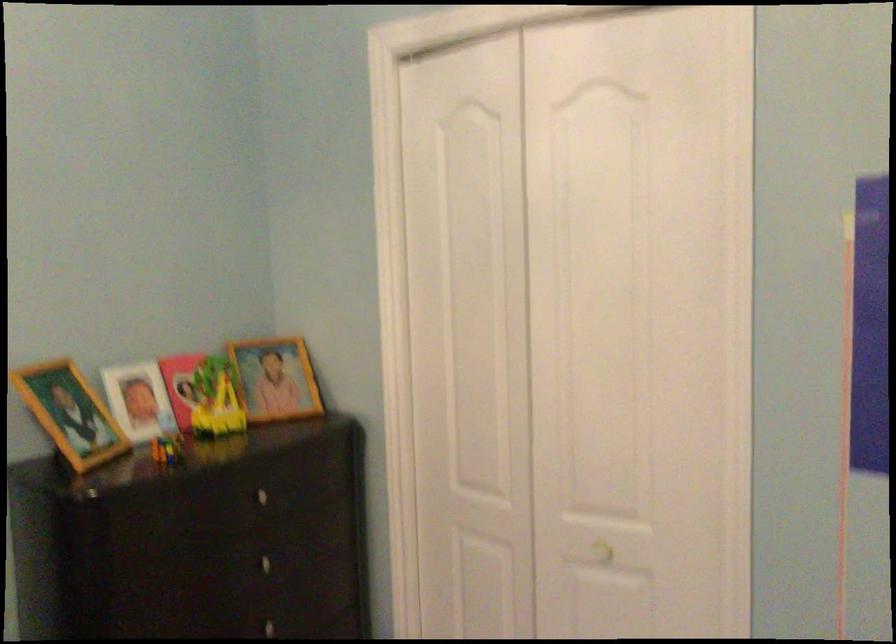
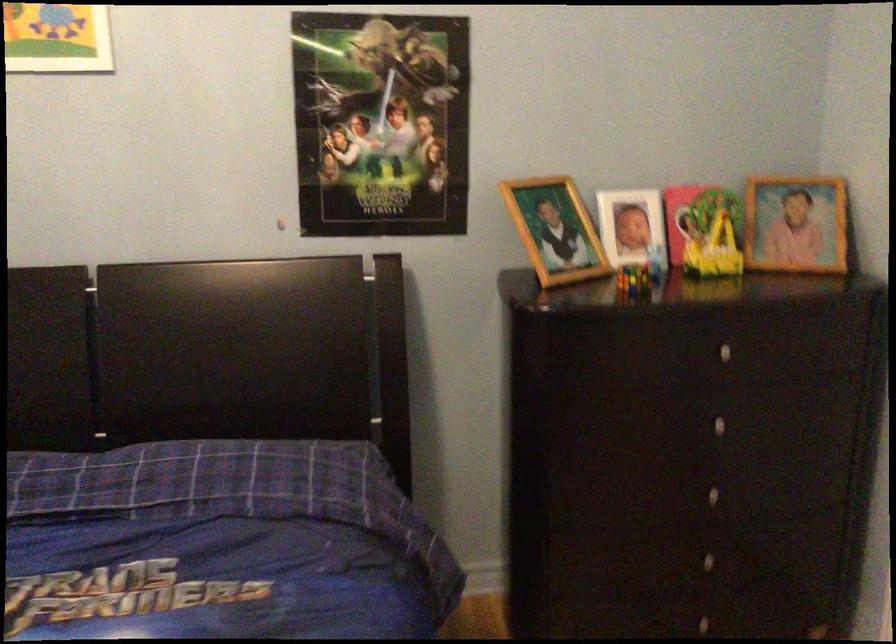
Question: I am providing you with two images of the same scene from different viewpoints. Please identify which objects are invisible in image2.

Choices:
 (A) silver drawer knob
 (B) wooden picture frame
 (C) white picture frame
 (D) none of these

Answer: (D)